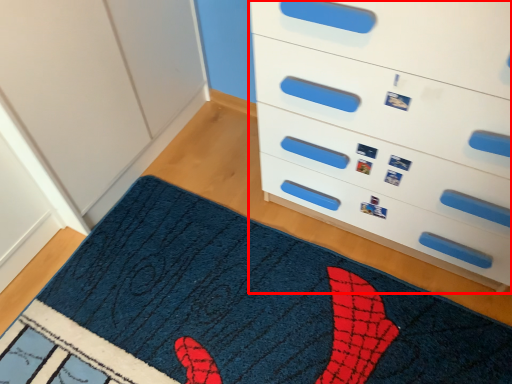
Question: Observing the image, what is the correct spatial positioning of chest of drawers (annotated by the red box) in reference to mat?

Choices:
 (A) right
 (B) left

Answer: (A)